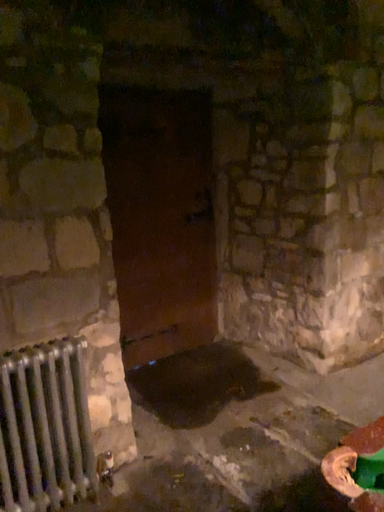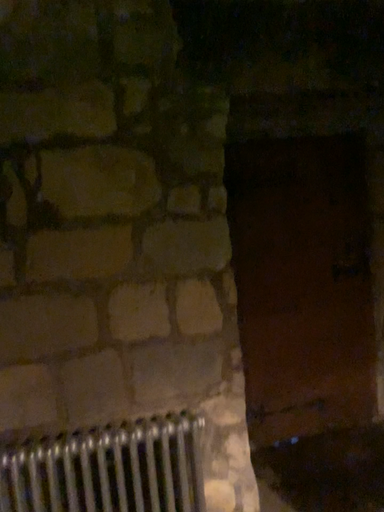
Question: How did the camera likely rotate when shooting the video?

Choices:
 (A) rotated upward
 (B) rotated downward

Answer: (A)